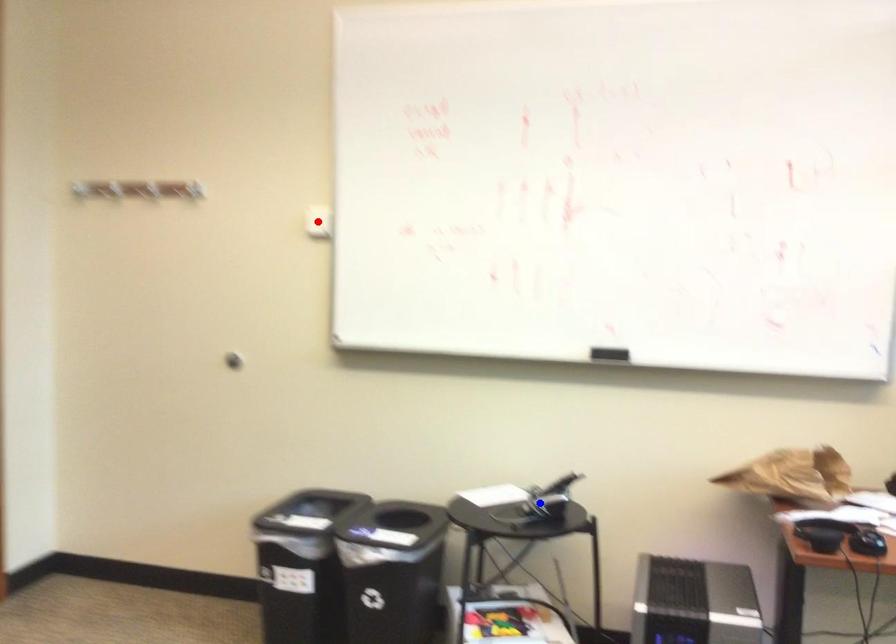
Question: In the image, two points are highlighted. Which point is nearer to the camera? Reply with the corresponding letter.

Choices:
 (A) blue point
 (B) red point

Answer: (A)